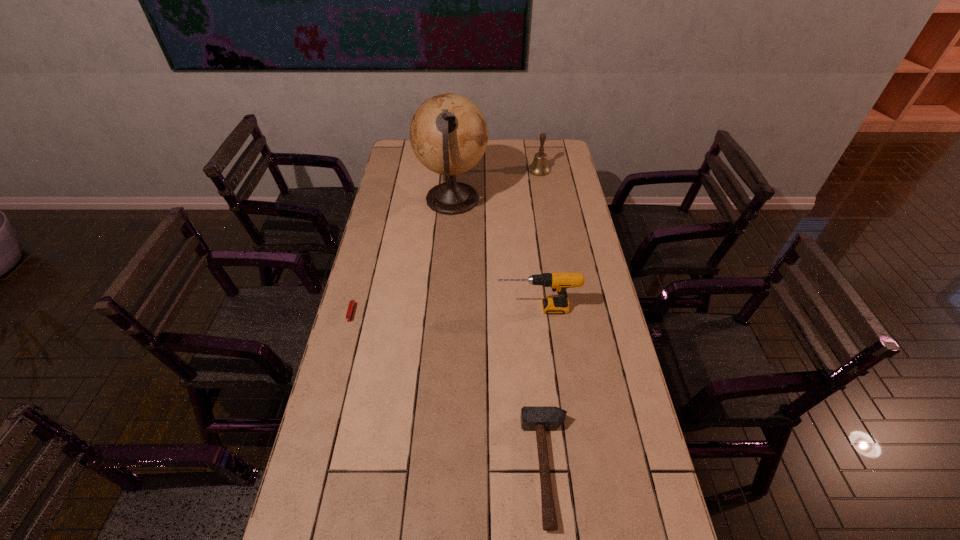
This screenshot has width=960, height=540. I want to click on the tallest object, so click(x=448, y=133).

This screenshot has height=540, width=960. Find the location of `globe`. globe is located at coordinates (448, 133).

This screenshot has width=960, height=540. I want to click on bell, so click(539, 167).

I want to click on drill, so click(559, 282).

Identify the location of the nearest object. The image size is (960, 540). (533, 418).

Find the location of a particular element. the fourth tallest object is located at coordinates (533, 418).

You are a GUI agent. You are given a task and a screenshot of the screen. Output one action in this format:
    pyautogui.click(x=<x>, y=<y>)
    Task: Click on the stapler
    The height and width of the screenshot is (540, 960).
    Given the screenshot: What is the action you would take?
    pyautogui.click(x=352, y=303)

Locate an element on the screen. The height and width of the screenshot is (540, 960). the leftmost object is located at coordinates [352, 303].

Locate an element on the screen. This screenshot has width=960, height=540. free space located on the front-facing side of the globe is located at coordinates (564, 200).

Where is `free spot located 0.190m on the front of the bell`? This screenshot has height=540, width=960. free spot located 0.190m on the front of the bell is located at coordinates (x=544, y=200).